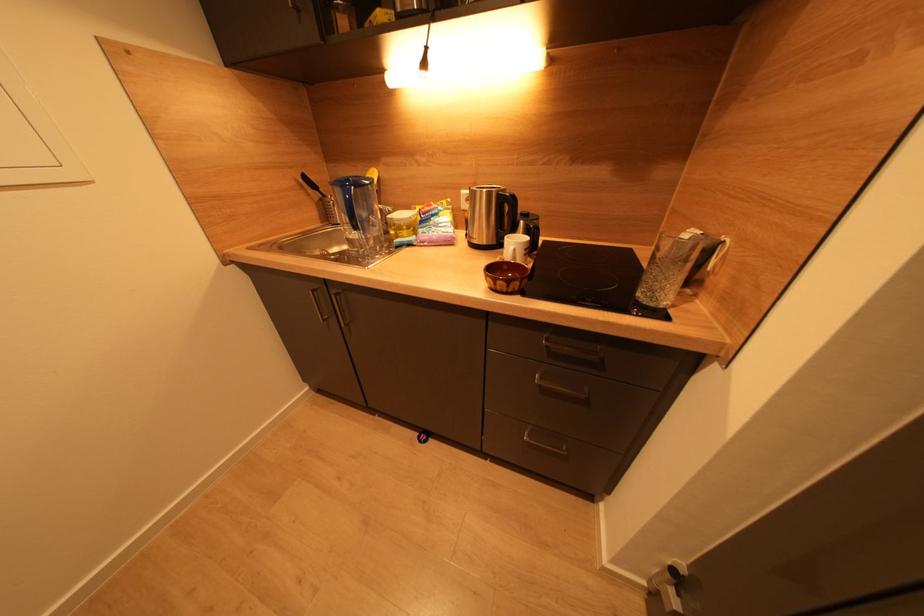
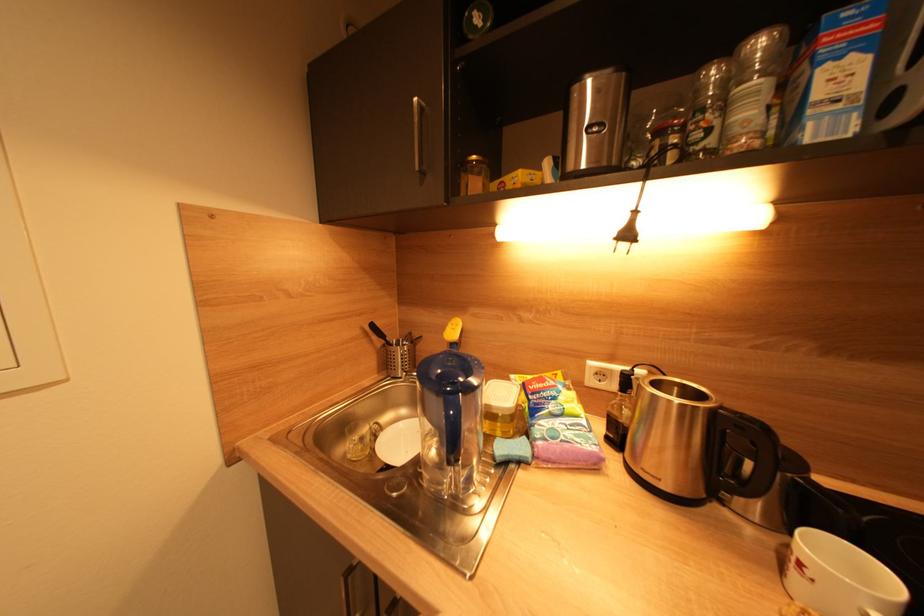
Question: The images are taken continuously from a first-person perspective. In which direction is your viewpoint rotating?

Choices:
 (A) Left
 (B) Right
 (C) Up
 (D) Down

Answer: (C)